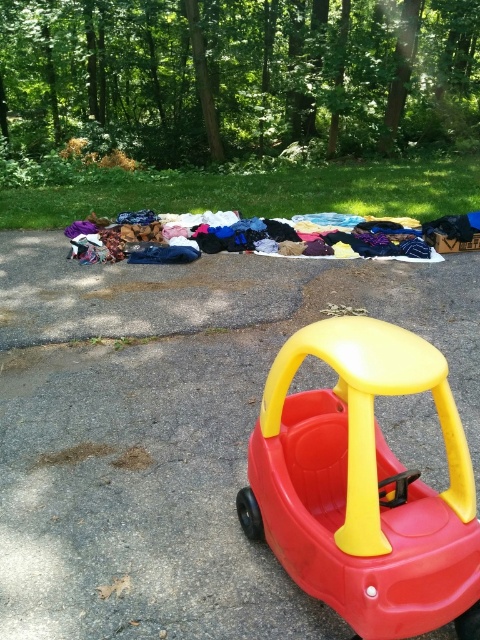
You are a parent trying to organize your child toys. You have a red plastic toy car at lower right and a matte plastic toy car at center. You want to place them on a shelf that is 3 feet wide. Can both fit side by side without overlapping?

The red plastic toy car at lower right and matte plastic toy car at center are 35.06 inches apart from each other. Since 3 feet equals 36 inches, they can fit side by side with about 0.94 inches of space between them.

You are standing at the point marked by the coordinates point (363, 484). Looking around, you see a bright red plastic toy car with yellow accents. Where is the bright red plastic toy car with yellow accents located relative to your current position?

The bright red plastic toy car with yellow accents is located at your current position, as the coordinates point (363, 484) represent the location of the matte plastic toy car at center.